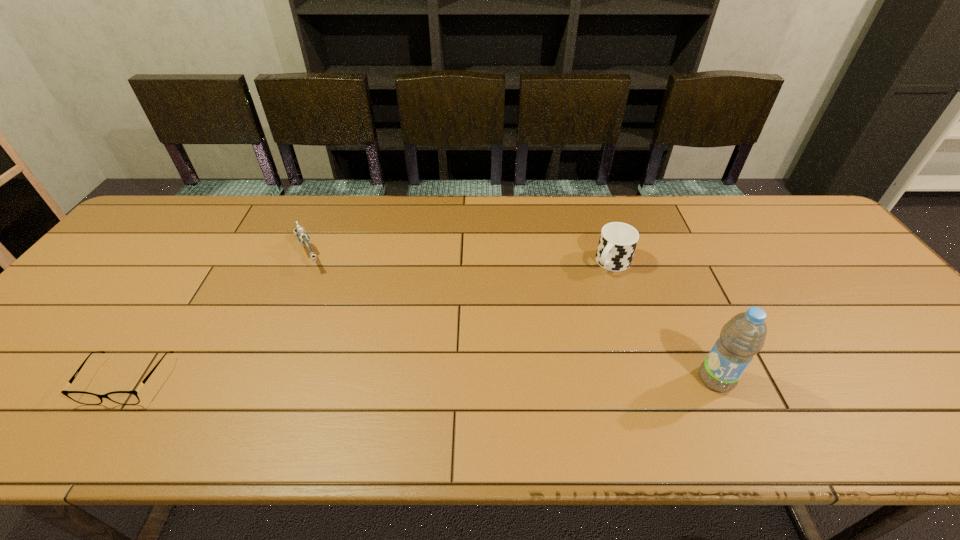
You are a GUI agent. You are given a task and a screenshot of the screen. Output one action in this format:
    pyautogui.click(x=<x>, y=<y>)
    Task: Click on the vacant space at the near left corner of the desktop
    This screenshot has width=960, height=540.
    Given the screenshot: What is the action you would take?
    pyautogui.click(x=53, y=400)

In the image, there is a desktop. At what (x,y) coordinates should I click in order to perform the action: click on blank space at the far right corner. Please return your answer as a coordinate pair (x, y). Looking at the image, I should click on (783, 204).

What are the coordinates of `free location at the near right corner of the desktop` in the screenshot? It's located at (910, 369).

Locate an element on the screen. This screenshot has height=540, width=960. empty location between the tallest object and the spectacles is located at coordinates (421, 380).

Where is `vacant area between the cup and the rightmost object`? vacant area between the cup and the rightmost object is located at coordinates 664,321.

Find the location of a particular element. Image resolution: width=960 pixels, height=540 pixels. empty location between the rightmost object and the leftmost object is located at coordinates (421, 380).

Find the location of `vacant space in between the spectacles and the rightmost object`. vacant space in between the spectacles and the rightmost object is located at coordinates (421, 380).

Where is `free space that is in between the leftmost object and the third tallest object`? free space that is in between the leftmost object and the third tallest object is located at coordinates (218, 316).

Locate an element on the screen. This screenshot has height=540, width=960. free space between the spectacles and the second object from right to left is located at coordinates (370, 321).

Locate an element on the screen. This screenshot has height=540, width=960. free spot between the cup and the water bottle is located at coordinates (664, 321).